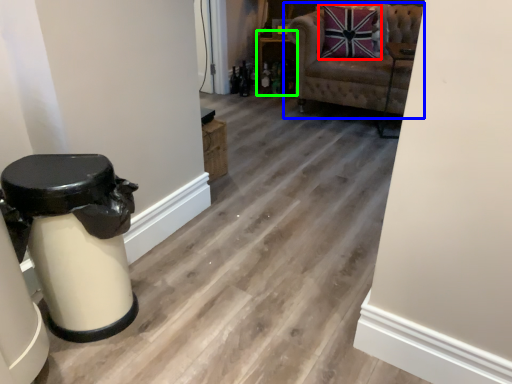
Question: Estimate the real-world distances between objects in this image. Which object is closer to pillow (highlighted by a red box), chair (highlighted by a blue box) or furniture (highlighted by a green box)?

Choices:
 (A) chair
 (B) furniture

Answer: (A)